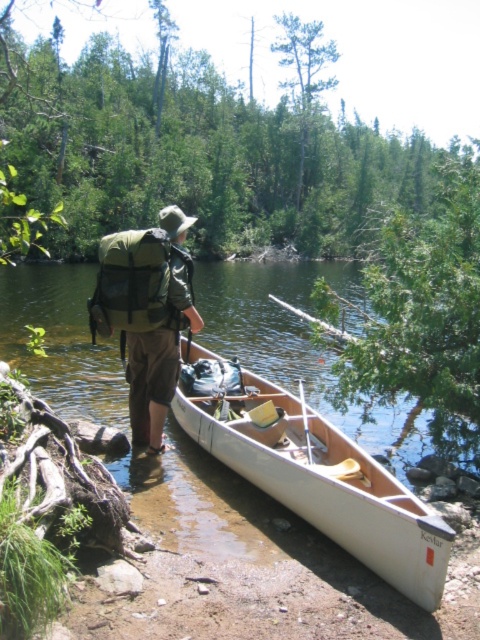
You are a hiker who wants to cross the clear water at center using the white wood canoe at center. Can you safely navigate the canoe across the water?

The clear water at center might be wider than the white wood canoe at center, so it is uncertain if the canoe can safely navigate the width. Check the distance before attempting to cross.

You are a photographer standing at the edge of the water. You want to take a clear photo of the white wood canoe at center without any obstructions. Considering your current position, can you step forward to get closer to the canoe?

The white wood canoe at center is 13.27 feet away from camera. Since you are the photographer at the camera position, stepping forward would reduce the distance. However, the scene mentions you are already at the edge of the water. Stepping further might lead you into the shallow water or unstable ground near the shore. To ensure stability and avoid splashing water into the canoe, it is advisable to remain at your current position to capture the photo clearly.